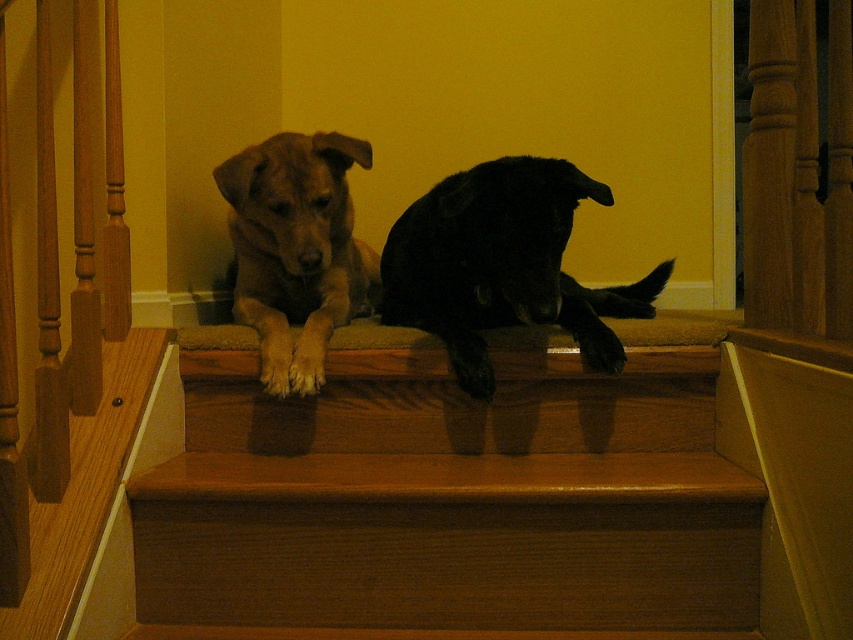
Question: Considering the real-world distances, which object is closest to the black matte paw at center?

Choices:
 (A) black matte dog at center
 (B) brown wood stairs at center
 (C) brown fur dog at center

Answer: (A)

Question: Which object appears farthest from the camera in this image?

Choices:
 (A) brown wood stairs at center
 (B) brown fur dog at center

Answer: (B)

Question: Can you confirm if brown fur dog at center is bigger than black matte paw at center?

Choices:
 (A) yes
 (B) no

Answer: (A)

Question: Is black matte dog at center smaller than black matte paw at center?

Choices:
 (A) no
 (B) yes

Answer: (A)

Question: Which of the following is the closest to the observer?

Choices:
 (A) brown fur dog at center
 (B) black matte paw at center
 (C) brown wood stairs at center
 (D) black matte dog at center

Answer: (C)

Question: Is black matte dog at center positioned behind brown fur dog at center?

Choices:
 (A) yes
 (B) no

Answer: (B)